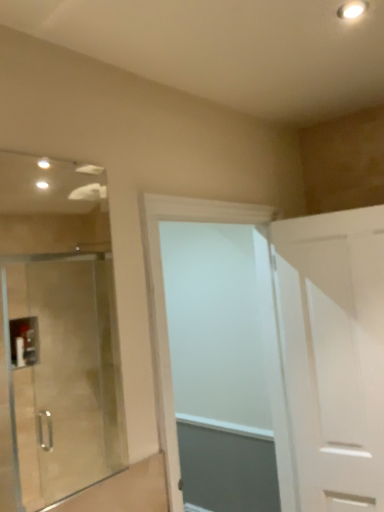
The image size is (384, 512). Describe the element at coordinates (165, 304) in the screenshot. I see `white matte door at center, marked as the 2th door in a right-to-left arrangement` at that location.

Find the location of a particular element. This screenshot has height=512, width=384. white matte door at center, which is the first door in left-to-right order is located at coordinates (165, 304).

You are a GUI agent. You are given a task and a screenshot of the screen. Output one action in this format:
    pyautogui.click(x=<x>, y=<y>)
    Task: Click on the white matte door at right, which is the 1th door from right to left
    
    Given the screenshot: What is the action you would take?
    pyautogui.click(x=333, y=354)

Describe the element at coordinates (333, 354) in the screenshot. I see `white matte door at right, marked as the second door in a left-to-right arrangement` at that location.

Where is `white matte door at center, which is the first door in left-to-right order`? Image resolution: width=384 pixels, height=512 pixels. white matte door at center, which is the first door in left-to-right order is located at coordinates (165, 304).

In the image, is white matte door at right, which is the 1th door from right to left, on the left side or the right side of white matte door at center, which is the first door in left-to-right order?

Clearly, white matte door at right, which is the 1th door from right to left, is on the right of white matte door at center, which is the first door in left-to-right order, in the image.

Based on the photo, is white matte door at right, marked as the second door in a left-to-right arrangement, further to camera compared to white matte door at center, which is the first door in left-to-right order?

Yes, it is.

Does point (311, 301) come farther from viewer compared to point (175, 477)?

Yes.

From the image's perspective, is white matte door at right, which is the 1th door from right to left, under white matte door at center, which is the first door in left-to-right order?

Actually, white matte door at right, which is the 1th door from right to left, appears above white matte door at center, which is the first door in left-to-right order, in the image.

From a real-world perspective, who is located higher, white matte door at right, which is the 1th door from right to left, or white matte door at center, which is the first door in left-to-right order?

white matte door at center, which is the first door in left-to-right order.

Can you confirm if white matte door at right, marked as the second door in a left-to-right arrangement, is thinner than white matte door at center, marked as the 2th door in a right-to-left arrangement?

Yes, white matte door at right, marked as the second door in a left-to-right arrangement, is thinner than white matte door at center, marked as the 2th door in a right-to-left arrangement.

Looking at this image, from their relative heights in the image, would you say white matte door at right, marked as the second door in a left-to-right arrangement, is taller or shorter than white matte door at center, marked as the 2th door in a right-to-left arrangement?

white matte door at right, marked as the second door in a left-to-right arrangement, is shorter than white matte door at center, marked as the 2th door in a right-to-left arrangement.

Is white matte door at right, which is the 1th door from right to left, bigger or smaller than white matte door at center, marked as the 2th door in a right-to-left arrangement?

white matte door at right, which is the 1th door from right to left, is smaller than white matte door at center, marked as the 2th door in a right-to-left arrangement.

Could white matte door at center, which is the first door in left-to-right order, be considered to be inside white matte door at right, which is the 1th door from right to left?

No, white matte door at center, which is the first door in left-to-right order, is located outside of white matte door at right, which is the 1th door from right to left.

Are white matte door at right, marked as the second door in a left-to-right arrangement, and white matte door at center, which is the first door in left-to-right order, beside each other?

No, white matte door at right, marked as the second door in a left-to-right arrangement, is not in contact with white matte door at center, which is the first door in left-to-right order.

Could you tell me if white matte door at right, which is the 1th door from right to left, is turned towards white matte door at center, marked as the 2th door in a right-to-left arrangement?

No, white matte door at right, which is the 1th door from right to left, is not aimed at white matte door at center, marked as the 2th door in a right-to-left arrangement.

How many degrees apart are the facing directions of white matte door at right, which is the 1th door from right to left, and white matte door at center, marked as the 2th door in a right-to-left arrangement?

The facing directions of white matte door at right, which is the 1th door from right to left, and white matte door at center, marked as the 2th door in a right-to-left arrangement, are 79.1 degrees apart.

How distant is white matte door at right, which is the 1th door from right to left, from white matte door at center, which is the first door in left-to-right order?

white matte door at right, which is the 1th door from right to left, and white matte door at center, which is the first door in left-to-right order, are 20.74 inches apart from each other.

The image size is (384, 512). Find the location of `door in front of the white matte door at right, marked as the second door in a left-to-right arrangement`. door in front of the white matte door at right, marked as the second door in a left-to-right arrangement is located at coordinates (165, 304).

Based on their positions, is white matte door at center, which is the first door in left-to-right order, located to the left or right of white matte door at right, marked as the second door in a left-to-right arrangement?

Based on their positions, white matte door at center, which is the first door in left-to-right order, is located to the left of white matte door at right, marked as the second door in a left-to-right arrangement.

Which object is further away from the camera taking this photo, white matte door at center, marked as the 2th door in a right-to-left arrangement, or white matte door at right, marked as the second door in a left-to-right arrangement?

white matte door at right, marked as the second door in a left-to-right arrangement, is behind.

Is point (177, 444) closer or farther from the camera than point (332, 408)?

Point (177, 444).

From the image's perspective, would you say white matte door at center, which is the first door in left-to-right order, is positioned over white matte door at right, marked as the second door in a left-to-right arrangement?

No, from the image's perspective, white matte door at center, which is the first door in left-to-right order, is not on top of white matte door at right, marked as the second door in a left-to-right arrangement.

From a real-world perspective, relative to white matte door at right, marked as the second door in a left-to-right arrangement, is white matte door at center, marked as the 2th door in a right-to-left arrangement, vertically above or below?

white matte door at center, marked as the 2th door in a right-to-left arrangement, is above white matte door at right, marked as the second door in a left-to-right arrangement.

Considering the sizes of objects white matte door at center, marked as the 2th door in a right-to-left arrangement, and white matte door at right, which is the 1th door from right to left, in the image provided, who is wider, white matte door at center, marked as the 2th door in a right-to-left arrangement, or white matte door at right, which is the 1th door from right to left,?

With larger width is white matte door at center, marked as the 2th door in a right-to-left arrangement.

Is white matte door at center, marked as the 2th door in a right-to-left arrangement, taller or shorter than white matte door at right, which is the 1th door from right to left?

Clearly, white matte door at center, marked as the 2th door in a right-to-left arrangement, is taller compared to white matte door at right, which is the 1th door from right to left.

Based on the photo, can you confirm if white matte door at center, which is the first door in left-to-right order, is smaller than white matte door at right, marked as the second door in a left-to-right arrangement?

No.

Which is correct: white matte door at center, which is the first door in left-to-right order, is inside white matte door at right, marked as the second door in a left-to-right arrangement, or outside of it?

white matte door at center, which is the first door in left-to-right order, is located beyond the bounds of white matte door at right, marked as the second door in a left-to-right arrangement.

Is white matte door at center, which is the first door in left-to-right order, not close to white matte door at right, which is the 1th door from right to left?

Actually, white matte door at center, which is the first door in left-to-right order, and white matte door at right, which is the 1th door from right to left, are a little close together.

Could you tell me if white matte door at center, which is the first door in left-to-right order, is facing white matte door at right, which is the 1th door from right to left?

Yes, white matte door at center, which is the first door in left-to-right order, is aimed at white matte door at right, which is the 1th door from right to left.

Identify the location of door above the white matte door at center, marked as the 2th door in a right-to-left arrangement (from the image's perspective). point(333,354).

Identify the location of door lying behind the white matte door at center, which is the first door in left-to-right order. (333, 354).

Locate an element on the screen. This screenshot has width=384, height=512. door in front of the white matte door at right, which is the 1th door from right to left is located at coordinates (165, 304).